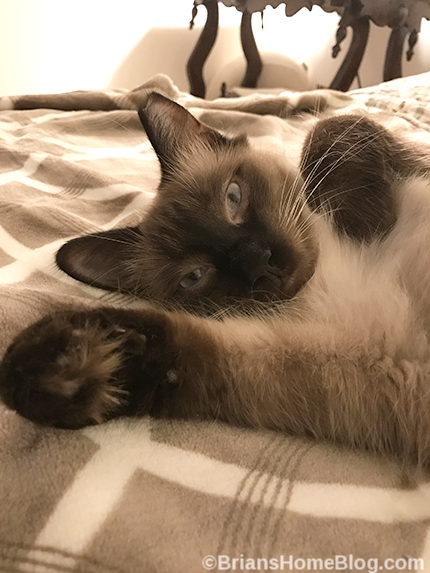
The height and width of the screenshot is (573, 430). What are the coordinates of `wall` in the screenshot? It's located at click(62, 32).